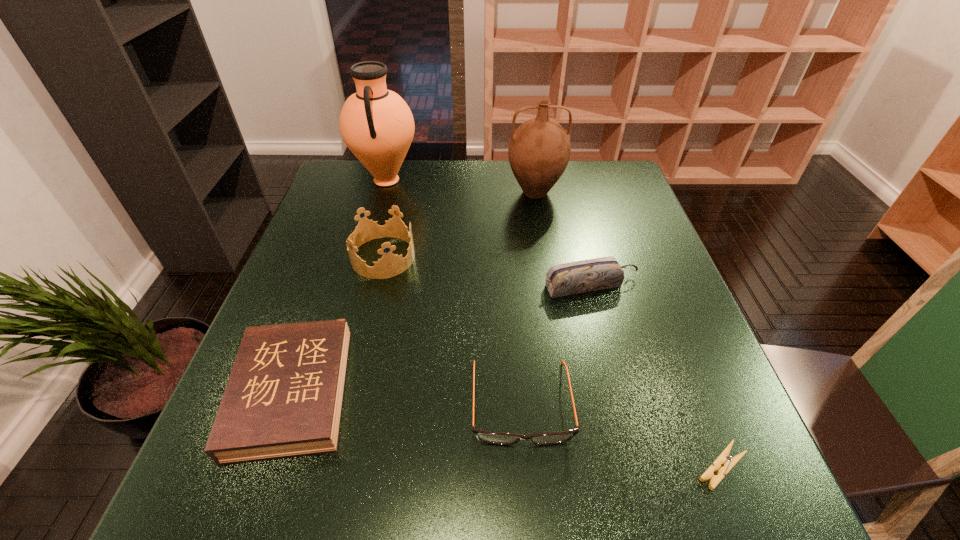
Locate an element on the screen. The height and width of the screenshot is (540, 960). object that stands as the second closest to the fifth shortest object is located at coordinates (284, 396).

Where is `the third closest object to the fourth tallest object`? The image size is (960, 540). the third closest object to the fourth tallest object is located at coordinates (390, 265).